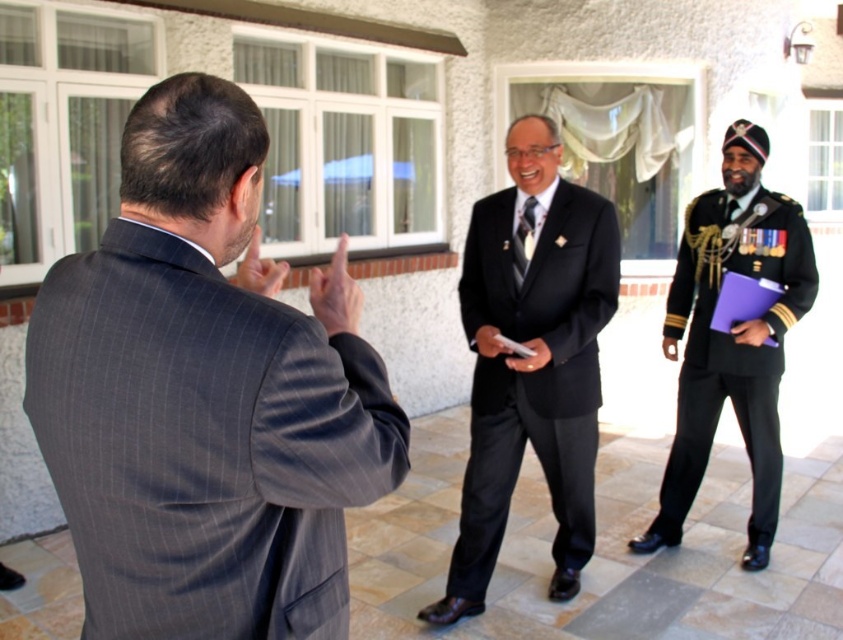
Question: Among these objects, which one is farthest from the camera?

Choices:
 (A) black uniform at right
 (B) black pinstripe suit at center

Answer: (A)

Question: Which object appears closest to the camera in this image?

Choices:
 (A) black pinstripe suit at center
 (B) black uniform at right
 (C) gray pinstripe suit at center

Answer: (C)

Question: Considering the relative positions of gray pinstripe suit at center and black pinstripe suit at center in the image provided, where is gray pinstripe suit at center located with respect to black pinstripe suit at center?

Choices:
 (A) below
 (B) above

Answer: (B)

Question: Considering the real-world distances, which object is farthest from the gray pinstripe suit at center?

Choices:
 (A) black pinstripe suit at center
 (B) black uniform at right

Answer: (B)

Question: Does gray pinstripe suit at center appear on the right side of black pinstripe suit at center?

Choices:
 (A) yes
 (B) no

Answer: (B)

Question: Does gray pinstripe suit at center have a lesser width compared to black pinstripe suit at center?

Choices:
 (A) no
 (B) yes

Answer: (B)